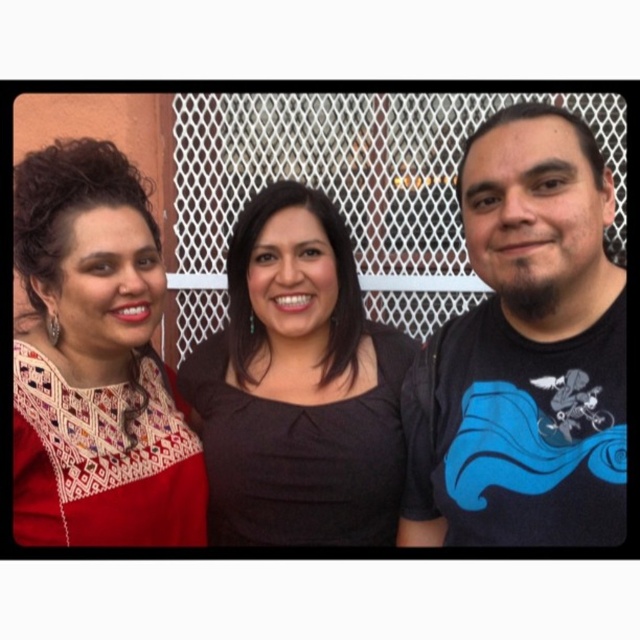
Does black cotton t-shirt at right have a lesser height compared to black matte dress at center?

No.

Who is more distant from viewer, (541, 392) or (266, 301)?

Positioned behind is point (266, 301).

Locate an element on the screen. black cotton t-shirt at right is located at coordinates (525, 352).

Is black cotton t-shirt at right shorter than embroidered fabric dress at left?

Yes, black cotton t-shirt at right is shorter than embroidered fabric dress at left.

Does black cotton t-shirt at right appear under embroidered fabric dress at left?

Correct, black cotton t-shirt at right is located below embroidered fabric dress at left.

Is point (563, 259) farther from camera compared to point (113, 328)?

That is False.

Locate an element on the screen. The height and width of the screenshot is (640, 640). black cotton t-shirt at right is located at coordinates (525, 352).

Does matte black dress at center lie in front of black matte dress at center?

No, it is not.

This screenshot has height=640, width=640. I want to click on matte black dress at center, so click(x=310, y=182).

Find the location of `matte black dress at center`. matte black dress at center is located at coordinates (310, 182).